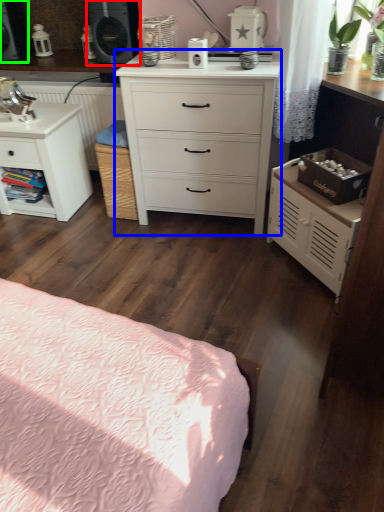
Question: Considering the real-world distances, which object is farthest from speaker (highlighted by a red box)? chest of drawers (highlighted by a blue box) or speaker (highlighted by a green box)?

Choices:
 (A) chest of drawers
 (B) speaker

Answer: (A)